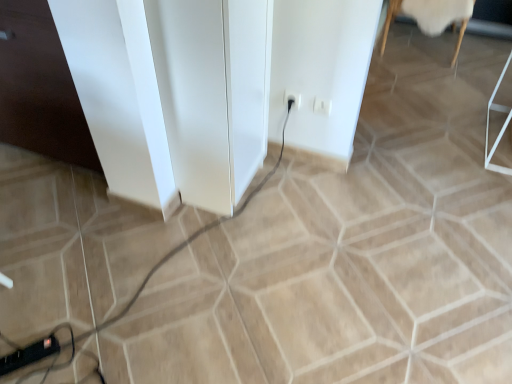
Question: Is white woolen rug at upper right closer to the viewer compared to white plastic electric outlet at center-right?

Choices:
 (A) no
 (B) yes

Answer: (A)

Question: Would you consider white woolen rug at upper right to be distant from white plastic electric outlet at center-right?

Choices:
 (A) no
 (B) yes

Answer: (B)

Question: From the image's perspective, is white woolen rug at upper right over white plastic electric outlet at center-right?

Choices:
 (A) no
 (B) yes

Answer: (B)

Question: Considering the relative sizes of white woolen rug at upper right and white plastic electric outlet at center-right in the image provided, is white woolen rug at upper right wider than white plastic electric outlet at center-right?

Choices:
 (A) no
 (B) yes

Answer: (B)

Question: Is white woolen rug at upper right thinner than white plastic electric outlet at center-right?

Choices:
 (A) no
 (B) yes

Answer: (A)

Question: Does point (50, 74) appear closer or farther from the camera than point (321, 102)?

Choices:
 (A) farther
 (B) closer

Answer: (B)

Question: Is white glossy file cabinet at left, the 1th file cabinet positioned from the left, to the left or to the right of white plastic socket at center in the image?

Choices:
 (A) left
 (B) right

Answer: (A)

Question: Considering their positions, is white glossy file cabinet at left, placed as the second file cabinet when sorted from right to left, located in front of or behind white plastic socket at center?

Choices:
 (A) front
 (B) behind

Answer: (A)

Question: From a real-world perspective, is white glossy file cabinet at left, the 1th file cabinet positioned from the left, above or below white plastic socket at center?

Choices:
 (A) below
 (B) above

Answer: (B)

Question: From the image's perspective, relative to white plastic socket at center, is black rubber cable at lower left above or below?

Choices:
 (A) below
 (B) above

Answer: (A)

Question: Considering their positions, is black rubber cable at lower left located in front of or behind white plastic socket at center?

Choices:
 (A) behind
 (B) front

Answer: (B)

Question: Is black rubber cable at lower left inside the boundaries of white plastic socket at center, or outside?

Choices:
 (A) inside
 (B) outside

Answer: (B)

Question: Based on their sizes in the image, would you say black rubber cable at lower left is bigger or smaller than white plastic socket at center?

Choices:
 (A) small
 (B) big

Answer: (B)

Question: Relative to black plastic extension cord at lower left, is white plastic socket at center in front or behind?

Choices:
 (A) front
 (B) behind

Answer: (B)

Question: Is point (317, 104) closer or farther from the camera than point (53, 349)?

Choices:
 (A) closer
 (B) farther

Answer: (B)